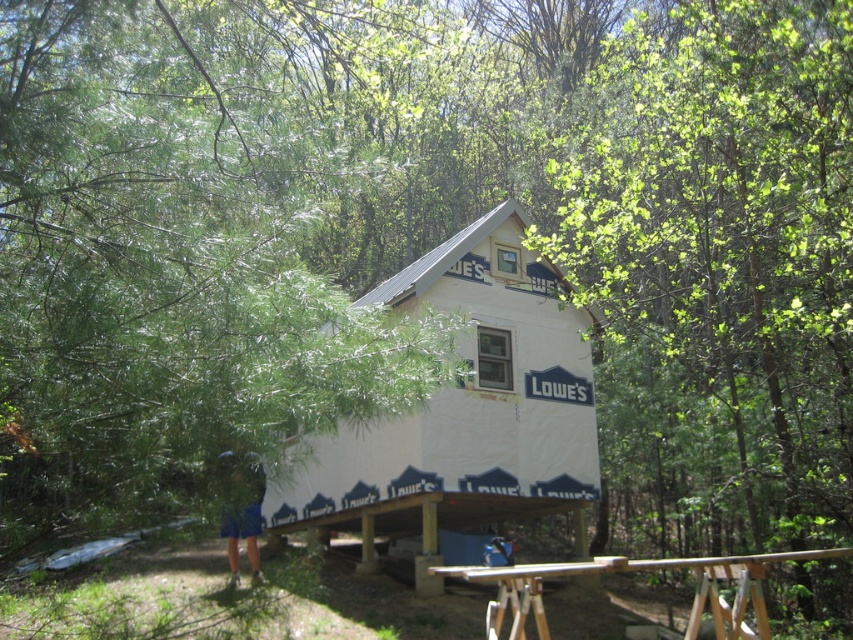
You are a contractor working on the partially constructed house. You need to move a heavy tool from the green leafy tree at upper left to the wooden picnic table at lower center. Is there a direct path between them without needing to go around any obstacles?

The green leafy tree at upper left is positioned over the wooden picnic table at lower center, so there is a direct path between them. You can move the tool directly from the green leafy tree at upper left to the wooden picnic table at lower center without needing to go around obstacles.